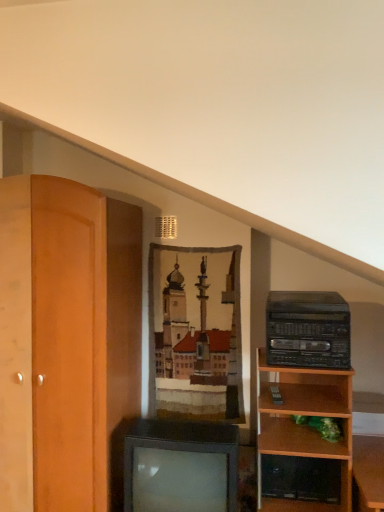
Locate an element on the screen. This screenshot has height=512, width=384. metallic gray television at center is located at coordinates (180, 467).

Image resolution: width=384 pixels, height=512 pixels. What do you see at coordinates (180, 467) in the screenshot? I see `metallic gray television at center` at bounding box center [180, 467].

In order to face black plastic stereo at right, should I rotate leftwards or rightwards?

Turn right approximately 14.913 degrees to face it.

Based on the photo, measure the distance between point [277,336] and camera.

Point [277,336] and camera are 6.12 feet apart from each other.

Identify the location of black plastic stereo at right. The image size is (384, 512). (308, 330).

Image resolution: width=384 pixels, height=512 pixels. Describe the element at coordinates (308, 330) in the screenshot. I see `black plastic stereo at right` at that location.

Where is `metallic gray television at center`? This screenshot has width=384, height=512. metallic gray television at center is located at coordinates (180, 467).

Between metallic gray television at center and black plastic stereo at right, which one appears on the right side from the viewer's perspective?

black plastic stereo at right is more to the right.

Which object is closer to the camera taking this photo, metallic gray television at center or black plastic stereo at right?

metallic gray television at center.

Which point is more distant from viewer, (172, 457) or (313, 301)?

The point (313, 301) is behind.

Based on the photo, from the image's perspective, which object appears higher, metallic gray television at center or black plastic stereo at right?

black plastic stereo at right, from the image's perspective.

From a real-world perspective, who is located lower, metallic gray television at center or black plastic stereo at right?

metallic gray television at center is physically lower.

Between metallic gray television at center and black plastic stereo at right, which one has smaller width?

black plastic stereo at right is thinner.

Which of these two, metallic gray television at center or black plastic stereo at right, stands taller?

With more height is metallic gray television at center.

Which of these two, metallic gray television at center or black plastic stereo at right, is smaller?

With smaller size is black plastic stereo at right.

Is black plastic stereo at right located within metallic gray television at center?

No.

Is metallic gray television at center far from black plastic stereo at right?

That's not correct — metallic gray television at center is a little close to black plastic stereo at right.

Is metallic gray television at center aimed at black plastic stereo at right?

No, metallic gray television at center is not aimed at black plastic stereo at right.

How many degrees apart are the facing directions of metallic gray television at center and black plastic stereo at right?

1.59 degrees.

Locate an element on the screen. The width and height of the screenshot is (384, 512). television on the left of black plastic stereo at right is located at coordinates (180, 467).

Considering the positions of objects black plastic stereo at right and metallic gray television at center in the image provided, who is more to the right, black plastic stereo at right or metallic gray television at center?

Positioned to the right is black plastic stereo at right.

Which object is more forward, black plastic stereo at right or metallic gray television at center?

metallic gray television at center.

Which is closer to the camera, (x=286, y=343) or (x=230, y=438)?

The point (x=230, y=438) is closer.

Looking at this image, from the image's perspective, is black plastic stereo at right located above or below metallic gray television at center?

Based on their image positions, black plastic stereo at right is located above metallic gray television at center.

From a real-world perspective, is black plastic stereo at right positioned above or below metallic gray television at center?

In terms of real-world spatial position, black plastic stereo at right is above metallic gray television at center.

Can you confirm if black plastic stereo at right is wider than metallic gray television at center?

No.

Between black plastic stereo at right and metallic gray television at center, which one has less height?

With less height is black plastic stereo at right.

Who is smaller, black plastic stereo at right or metallic gray television at center?

black plastic stereo at right is smaller.

From the picture: Is black plastic stereo at right completely or partially outside of metallic gray television at center?

That's correct, black plastic stereo at right is outside of metallic gray television at center.

Consider the image. Can you see black plastic stereo at right touching metallic gray television at center?

black plastic stereo at right and metallic gray television at center are not in contact.

Could you tell me if black plastic stereo at right is turned towards metallic gray television at center?

No, black plastic stereo at right is not turned towards metallic gray television at center.

Identify the location of stereo above the metallic gray television at center (from the image's perspective). This screenshot has height=512, width=384. (308, 330).

The width and height of the screenshot is (384, 512). I want to click on television located on the left of black plastic stereo at right, so click(180, 467).

Where is `television below the black plastic stereo at right (from a real-world perspective)`? television below the black plastic stereo at right (from a real-world perspective) is located at coordinates (180, 467).